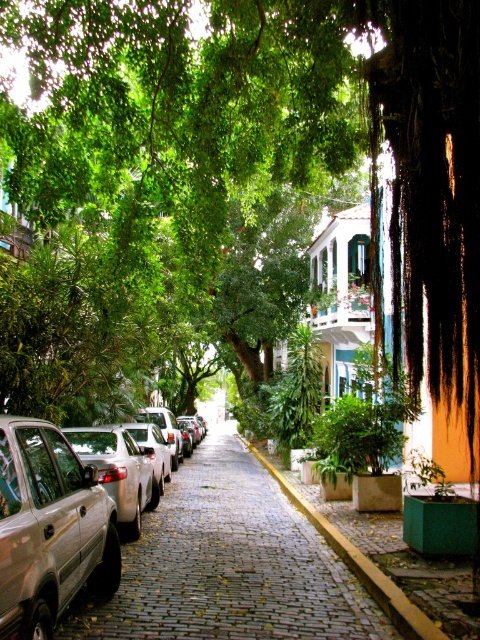
Question: From the image, what is the correct spatial relationship of cobblestone pavement at center in relation to silver metallic car at left?

Choices:
 (A) left
 (B) right

Answer: (B)

Question: Can you confirm if cobblestone pavement at center is thinner than silver metallic car at left?

Choices:
 (A) no
 (B) yes

Answer: (A)

Question: Is cobblestone pavement at center below silver metallic car at left?

Choices:
 (A) no
 (B) yes

Answer: (B)

Question: Among these objects, which one is farthest from the camera?

Choices:
 (A) cobblestone pavement at center
 (B) silver metallic car at left

Answer: (A)